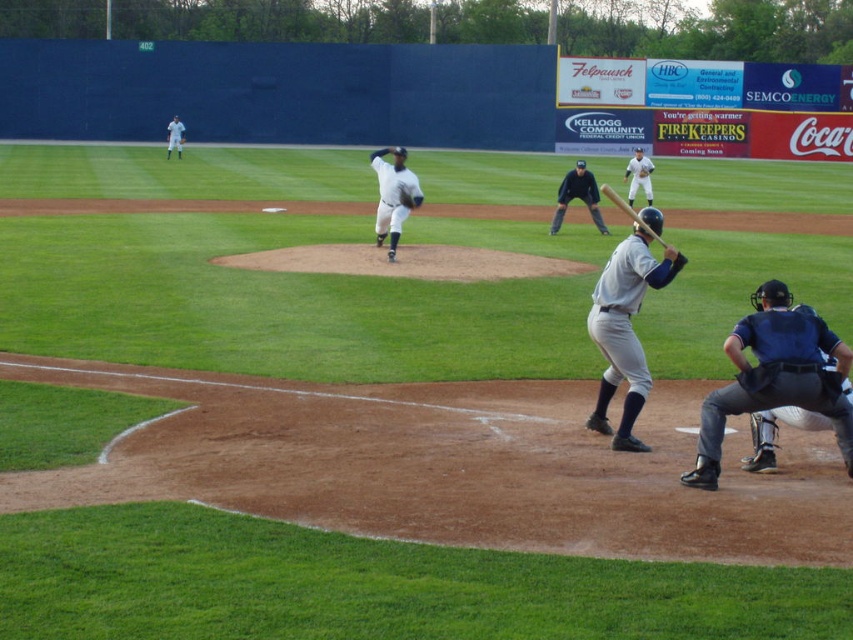
Consider the image. Can you confirm if white matte baseball glove at center is positioned above white leather glove at center?

Incorrect, white matte baseball glove at center is not positioned above white leather glove at center.

Which is in front, point (375, 157) or point (645, 176)?

Point (375, 157) is more forward.

This screenshot has width=853, height=640. What do you see at coordinates (393, 195) in the screenshot?
I see `white matte baseball glove at center` at bounding box center [393, 195].

Where is `white matte baseball glove at center`? Image resolution: width=853 pixels, height=640 pixels. white matte baseball glove at center is located at coordinates (393, 195).

Where is `blue padded gear at lower right`? The height and width of the screenshot is (640, 853). blue padded gear at lower right is located at coordinates (775, 376).

Does white uniform at center appear under white uniform at upper left?

Indeed, white uniform at center is positioned under white uniform at upper left.

Identify the location of white uniform at center. The height and width of the screenshot is (640, 853). (637, 177).

At what (x,y) coordinates should I click in order to perform the action: click on white uniform at center. Please return your answer as a coordinate pair (x, y). This screenshot has width=853, height=640. Looking at the image, I should click on pos(637,177).